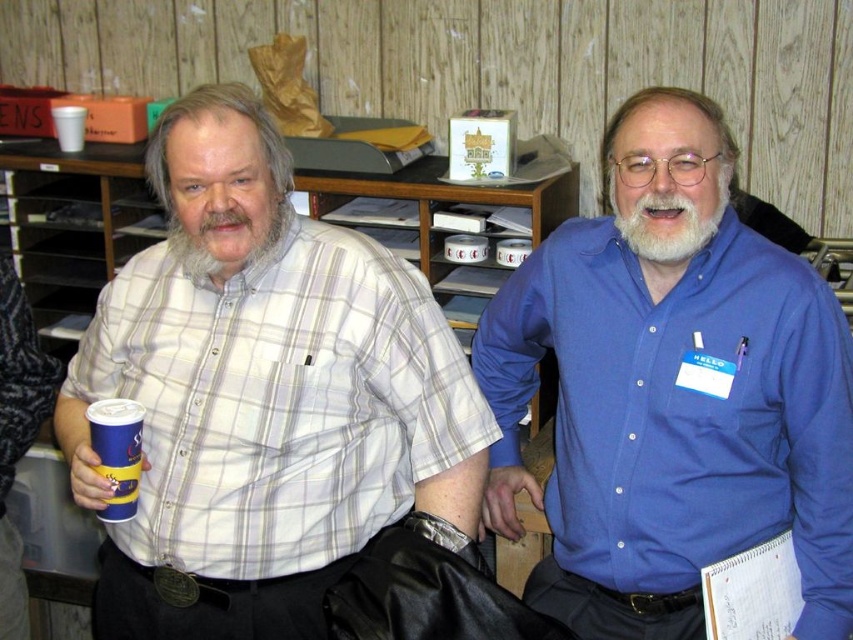
Question: Which point is closer to the camera?

Choices:
 (A) blue button-up shirt at center
 (B) blue paper cup at left

Answer: (A)

Question: Which point is closer to the camera?

Choices:
 (A) white plaid shirt at left
 (B) blue paper cup at left
 (C) grayhairbeard at center
 (D) blue button-up shirt at center

Answer: (D)

Question: Which of the following is the closest to the observer?

Choices:
 (A) (347, 552)
 (B) (280, 225)

Answer: (A)

Question: Is blue button-up shirt at center to the right of white plaid shirt at left from the viewer's perspective?

Choices:
 (A) no
 (B) yes

Answer: (B)

Question: Is grayhairbeard at center bigger than whitehairbeard at center?

Choices:
 (A) no
 (B) yes

Answer: (B)

Question: Can you confirm if grayhairbeard at center is positioned below whitehairbeard at center?

Choices:
 (A) no
 (B) yes

Answer: (B)